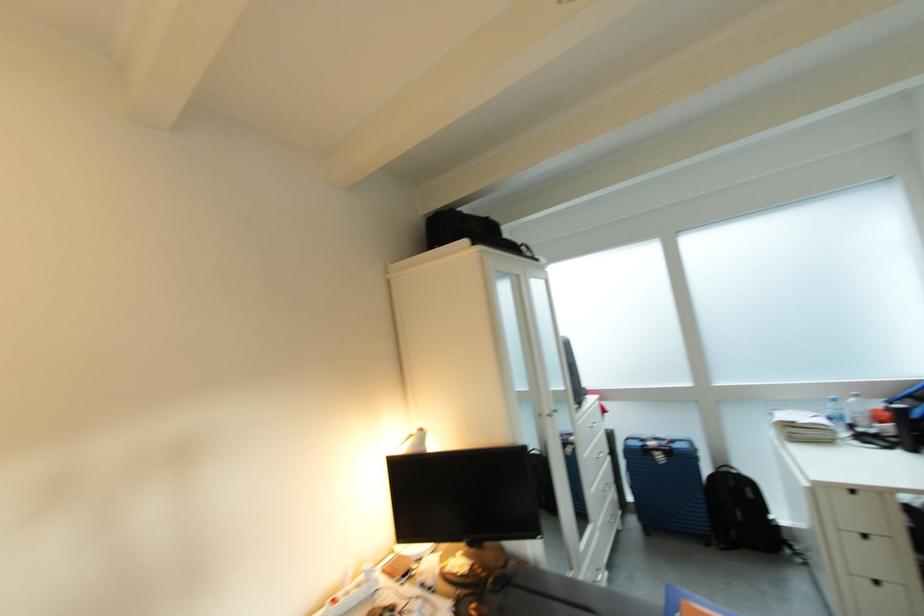
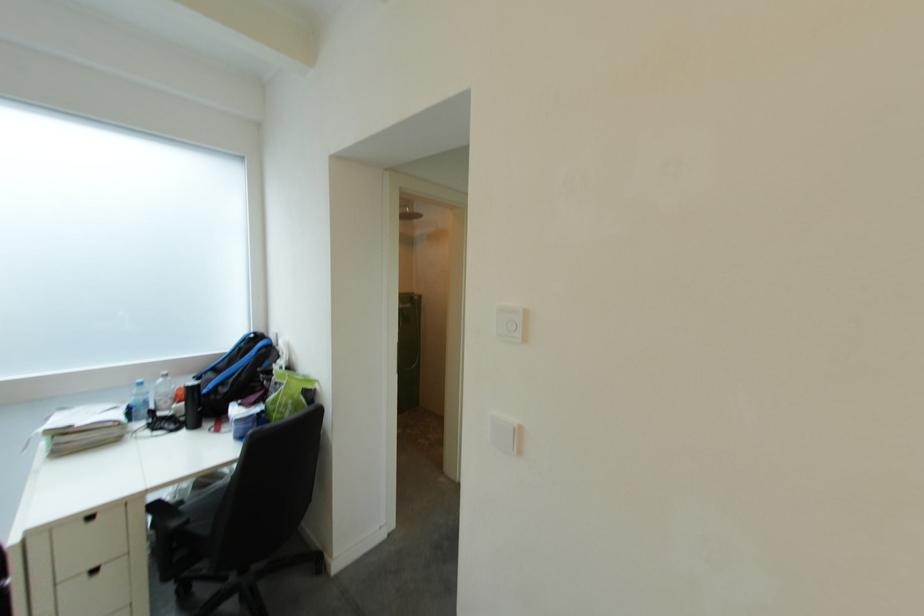
Where in the second image is the point corresponding to (861,426) from the first image?

(163, 410)